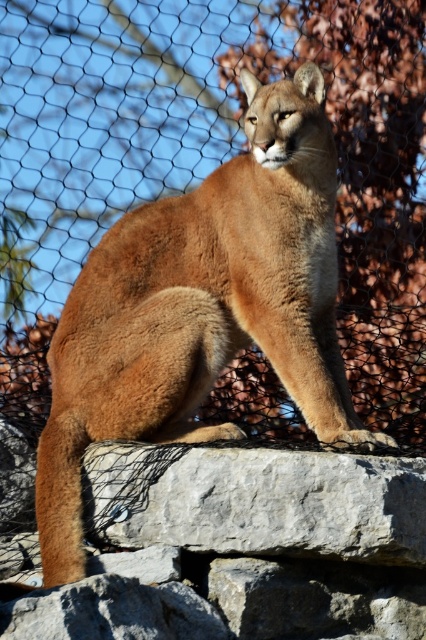
Describe the element at coordinates (259, 500) in the screenshot. The width and height of the screenshot is (426, 640). I see `gray stone boulder at center` at that location.

Is gray stone boulder at center above gray rough rock at lower center?

Indeed, gray stone boulder at center is positioned over gray rough rock at lower center.

You are a GUI agent. You are given a task and a screenshot of the screen. Output one action in this format:
    pyautogui.click(x=<x>, y=<y>)
    Task: Click on the gray stone boulder at center
    The image size is (426, 640).
    Given the screenshot: What is the action you would take?
    pyautogui.click(x=259, y=500)

Is golden fur cougar at center positioned at the back of gray stone boulder at center?

Yes.

Which is above, golden fur cougar at center or gray stone boulder at center?

golden fur cougar at center

Between point (314, 244) and point (377, 561), which one is positioned in front?

Point (377, 561) is in front.

Locate an element on the screen. golden fur cougar at center is located at coordinates (201, 308).

Between golden fur cougar at center and gray rough rock at lower center, which one is positioned lower?

gray rough rock at lower center

Can you confirm if golden fur cougar at center is positioned below gray rough rock at lower center?

No.

Identify the location of golden fur cougar at center. Image resolution: width=426 pixels, height=640 pixels. (201, 308).